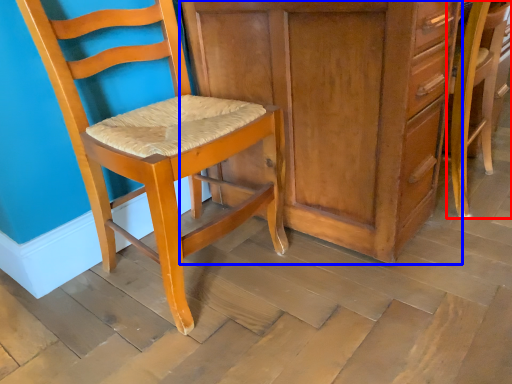
Question: Which object appears farthest to the camera in this image, chair (highlighted by a red box) or cabinetry (highlighted by a blue box)?

Choices:
 (A) chair
 (B) cabinetry

Answer: (A)